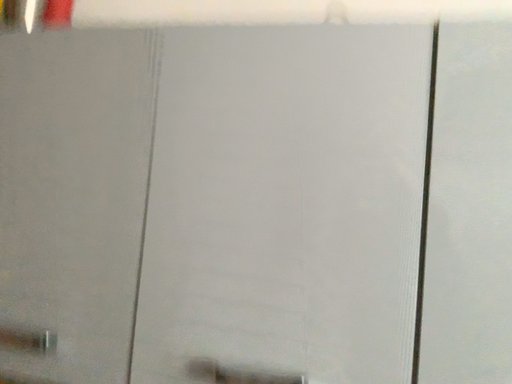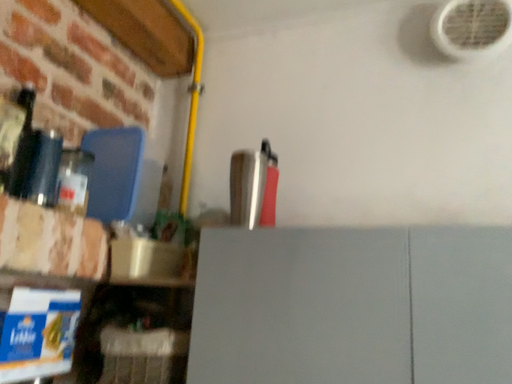
Question: Which way did the camera rotate in the video?

Choices:
 (A) rotated right
 (B) rotated left

Answer: (B)